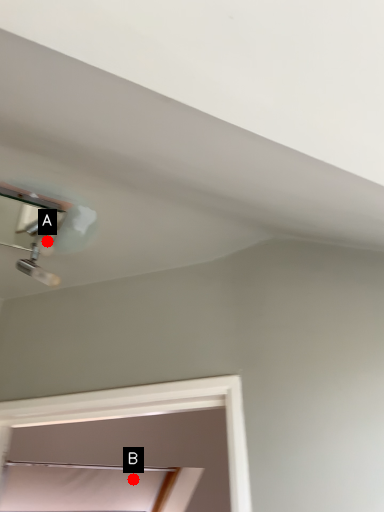
Question: Two points are circled on the image, labeled by A and B beside each circle. Which point is closer to the camera?

Choices:
 (A) A is closer
 (B) B is closer

Answer: (A)